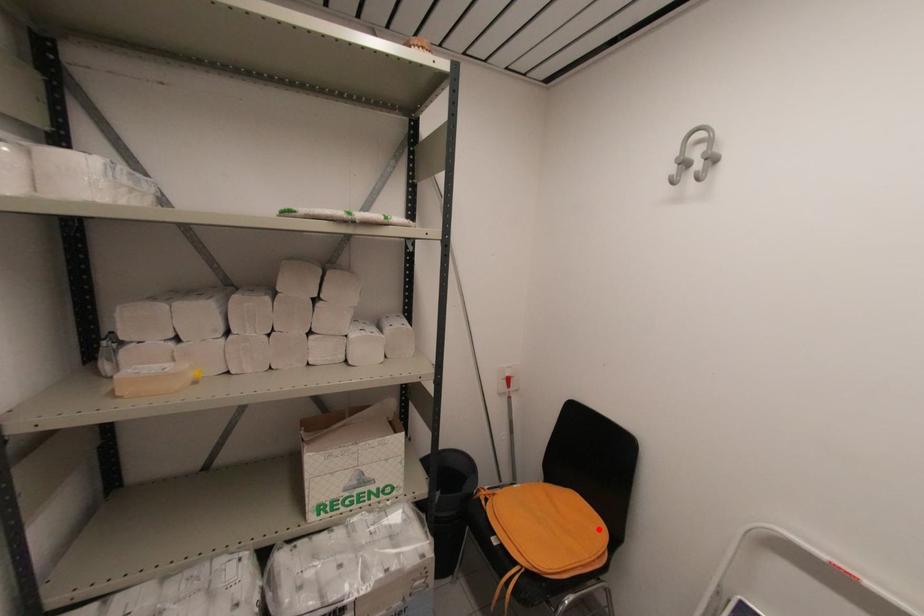
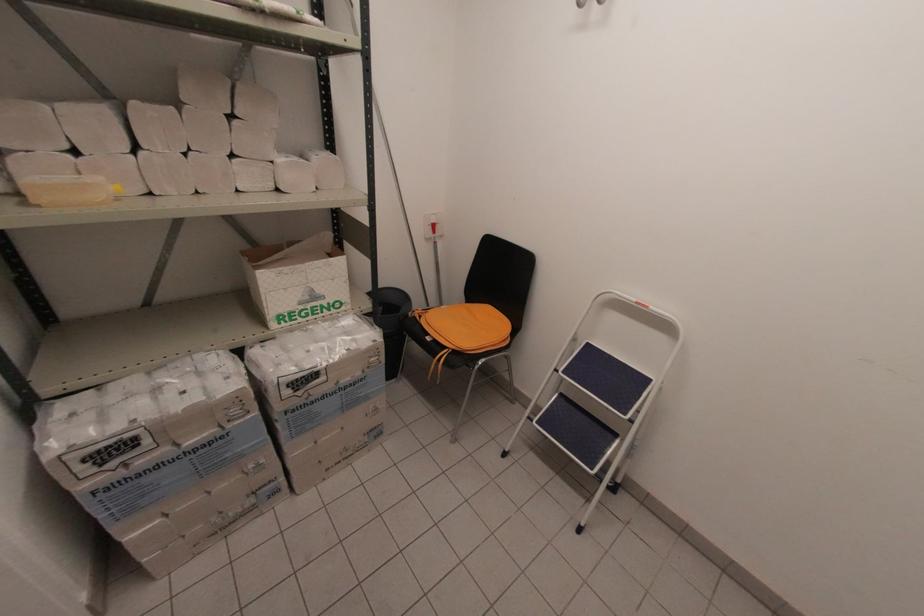
The point at the highlighted location is marked in the first image. Where is the corresponding point in the second image?

(505, 325)